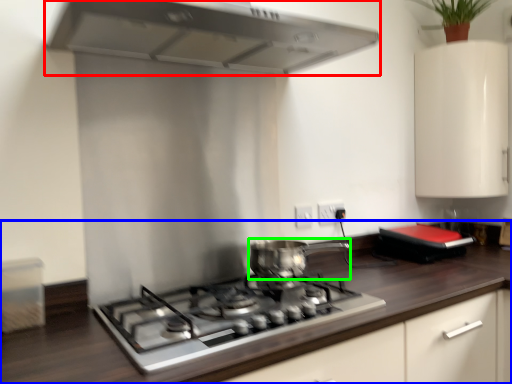
Question: Considering the real-world distances, which object is farthest from home appliance (highlighted by a red box)? countertop (highlighted by a blue box) or kitchen appliance (highlighted by a green box)?

Choices:
 (A) countertop
 (B) kitchen appliance

Answer: (A)